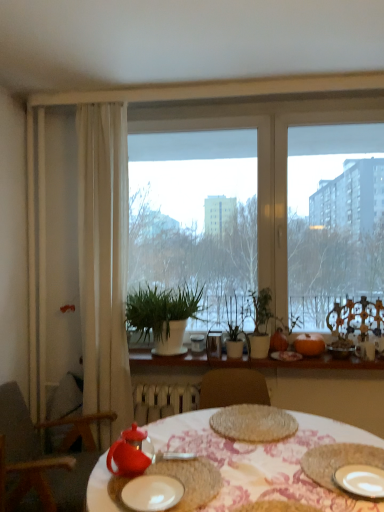
The width and height of the screenshot is (384, 512). I want to click on vacant space that is to the left of white matte plate at center, marked as the first plate in a left-to-right arrangement, so click(x=106, y=495).